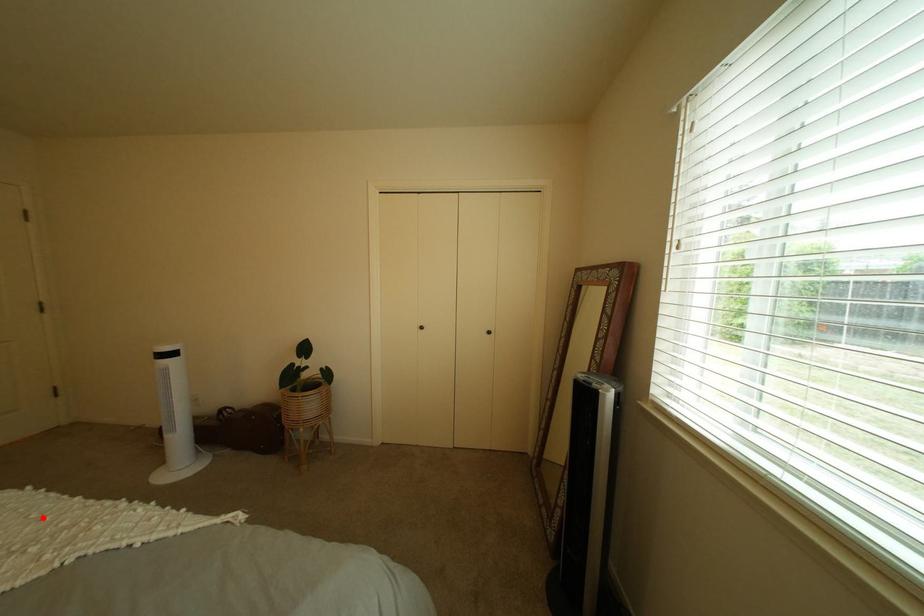
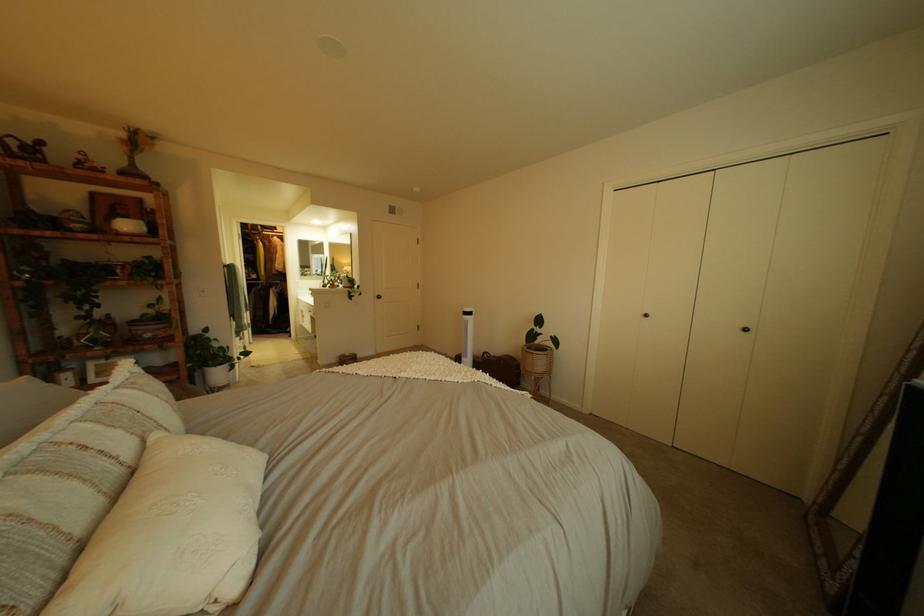
Question: I am providing you with two images of the same scene from different viewpoints. In image1, a red point is highlighted. Considering the same 3D point in image2, which of the following is correct?

Choices:
 (A) It is closer
 (B) It is farther

Answer: (A)